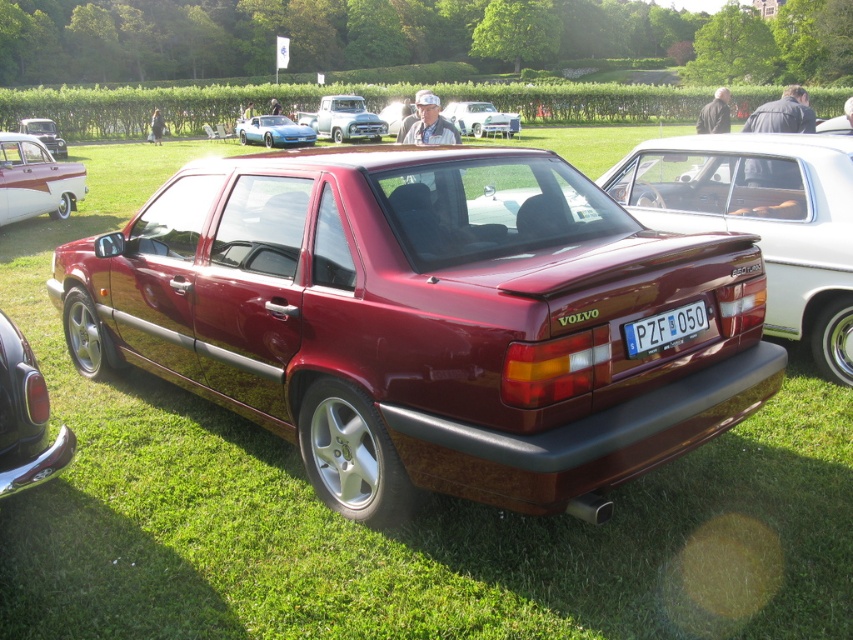
You are a photographer trying to capture both the satin burgundy car at center and the matte white car at left in a single frame. Given their sizes, which car should you position closer to the camera to ensure both appear proportionally balanced in the photo?

To balance the proportions of both cars in the photo, you should position the matte white car at left closer to the camera since the satin burgundy car at center is larger and will appear bigger even from a distance.

You are a photographer at the car exhibition and need to capture both the matte white car at left and the white plastic license plate at center in a single frame. Which object should you position closer to the camera to ensure both fit within the shot?

The matte white car at left is wider than the white plastic license plate at center. To ensure both fit in the frame, position the matte white car at left closer to the camera so its width can be accommodated while still including the white plastic license plate at center in the shot.